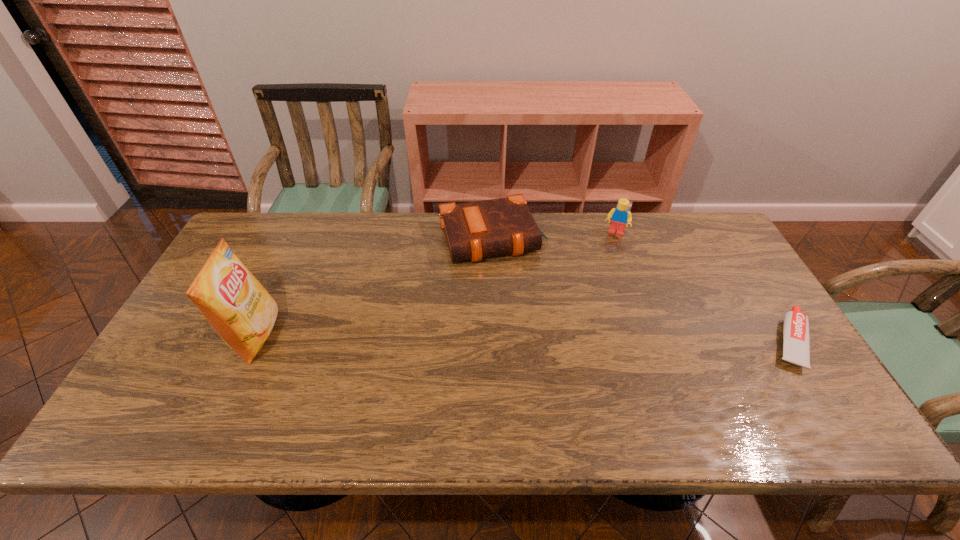
The width and height of the screenshot is (960, 540). I want to click on vacant spot on the desktop that is between the leftmost object and the toothpaste and is positioned on the spine side of the second object from left to right, so click(530, 339).

Find the location of a particular element. The height and width of the screenshot is (540, 960). vacant space on the desktop that is between the leftmost object and the toothpaste and is positioned on the front-facing side of the second tallest object is located at coordinates (585, 339).